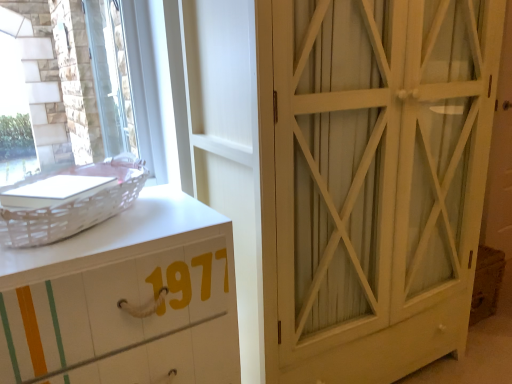
Question: From the image's perspective, is white wood cabinet at right located above or below white painted wood chest of drawers at left?

Choices:
 (A) above
 (B) below

Answer: (A)

Question: Is point (305, 259) closer or farther from the camera than point (153, 210)?

Choices:
 (A) farther
 (B) closer

Answer: (A)

Question: Which object is the closest to the white wood cabinet at right?

Choices:
 (A) white wicker basket at left
 (B) clear glass window at upper left
 (C) white painted wood chest of drawers at left

Answer: (C)

Question: Based on their relative distances, which object is nearer to the clear glass window at upper left?

Choices:
 (A) white wood cabinet at right
 (B) white wicker basket at left
 (C) white painted wood chest of drawers at left

Answer: (B)